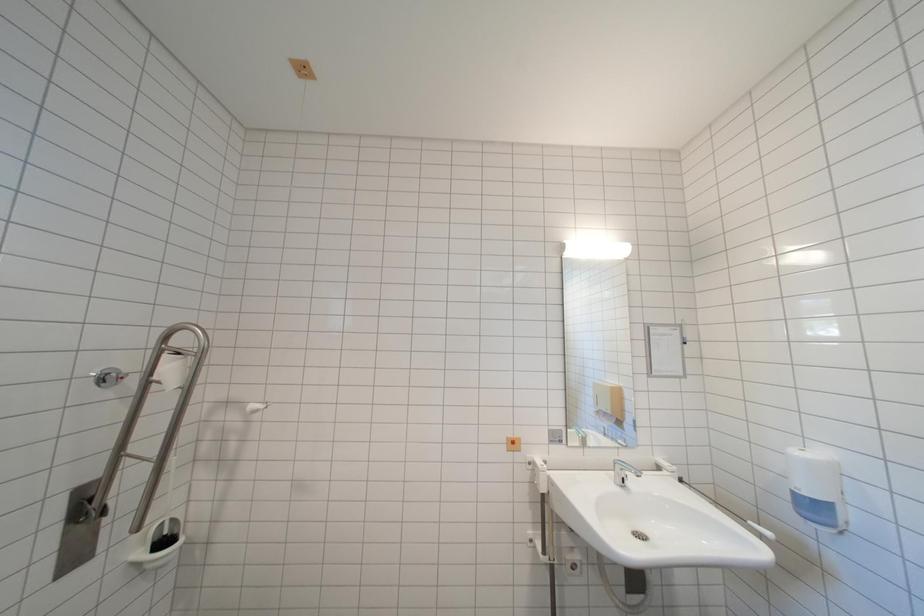
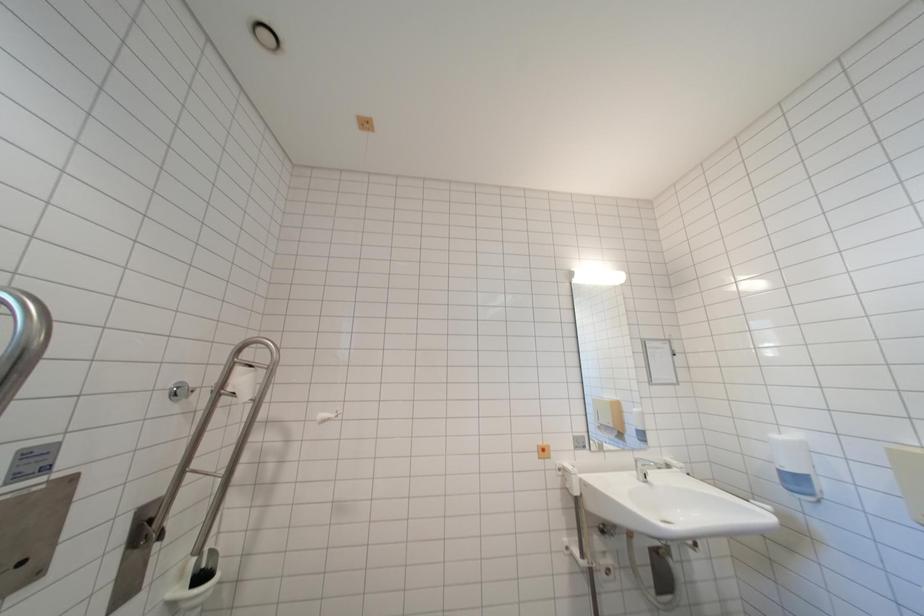
The images are taken continuously from a first-person perspective. In which direction are you moving?

The cameraman walked toward left, backward.